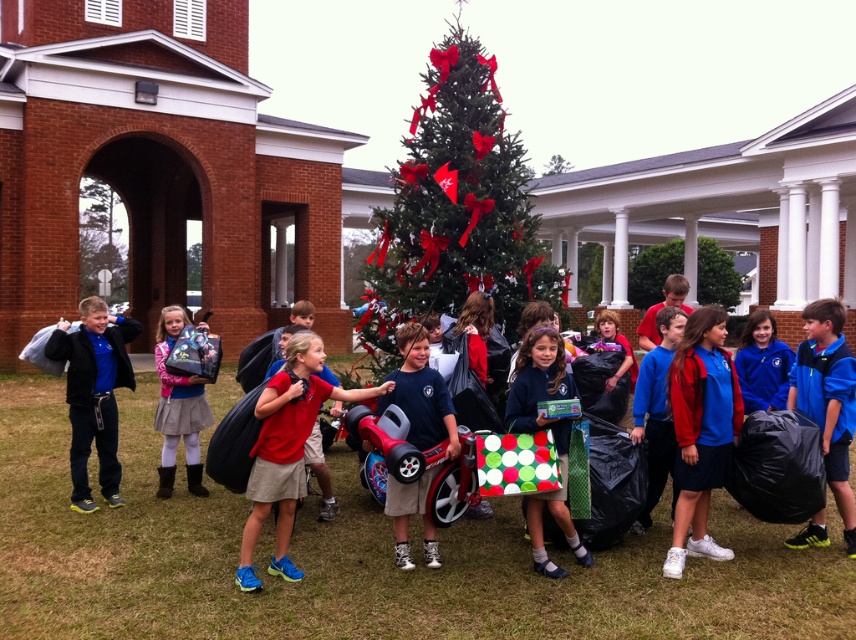
Can you confirm if blue fleece jacket at left is smaller than blue fabric shirt at center?

Correct, blue fleece jacket at left occupies less space than blue fabric shirt at center.

From the picture: Is blue fleece jacket at left further to camera compared to blue fabric shirt at center?

Yes, blue fleece jacket at left is behind blue fabric shirt at center.

Identify the location of blue fleece jacket at left. This screenshot has width=856, height=640. (94, 394).

Which is more to the right, blue fabric shirt at center or matte black backpack at center?

blue fabric shirt at center

Who is positioned more to the left, blue fabric shirt at center or matte black backpack at center?

Positioned to the left is matte black backpack at center.

Between point (428, 435) and point (185, 444), which one is positioned behind?

The point (185, 444) is behind.

At what (x,y) coordinates should I click in order to perform the action: click on blue fabric shirt at center. Please return your answer as a coordinate pair (x, y). Looking at the image, I should click on (420, 394).

Between green artificial christmas tree at center and blue fleece jacket at left, which one is positioned lower?

Positioned lower is blue fleece jacket at left.

Consider the image. Who is taller, green artificial christmas tree at center or blue fleece jacket at left?

green artificial christmas tree at center is taller.

Is point (482, 272) positioned before point (88, 403)?

No, it is behind (88, 403).

The height and width of the screenshot is (640, 856). Find the location of `green artificial christmas tree at center`. green artificial christmas tree at center is located at coordinates (456, 209).